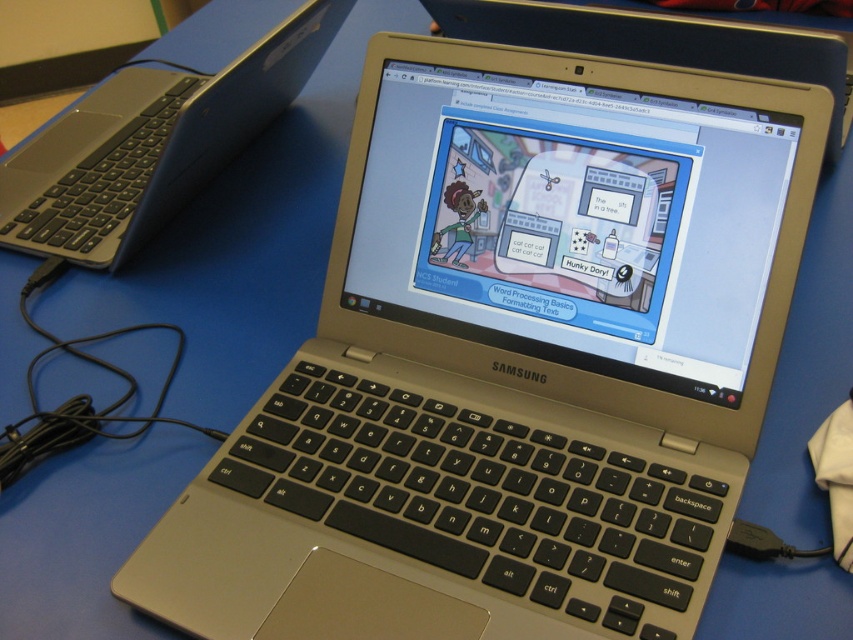
Question: Is silver metallic laptop at center to the right of metallic silver laptop at center from the viewer's perspective?

Choices:
 (A) yes
 (B) no

Answer: (B)

Question: Which point is closer to the camera taking this photo?

Choices:
 (A) (628, 49)
 (B) (146, 128)

Answer: (A)

Question: Does silver metallic laptop at center appear over metallic silver laptop at center?

Choices:
 (A) no
 (B) yes

Answer: (A)

Question: Which of the following is the closest to the observer?

Choices:
 (A) (552, 38)
 (B) (0, 170)

Answer: (A)

Question: Is silver metallic laptop at center positioned at the back of metallic silver laptop at center?

Choices:
 (A) no
 (B) yes

Answer: (B)